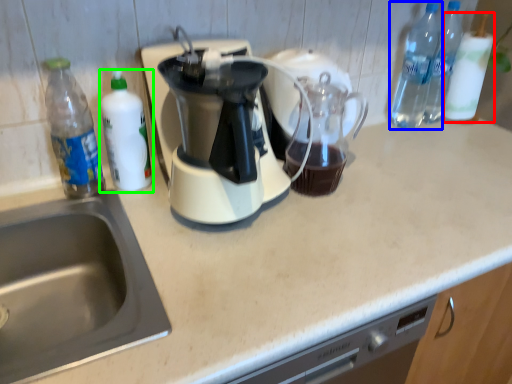
Question: Estimate the real-world distances between objects in this image. Which object is closer to bottle (highlighted by a red box), bottle (highlighted by a blue box) or bottle (highlighted by a green box)?

Choices:
 (A) bottle
 (B) bottle

Answer: (A)